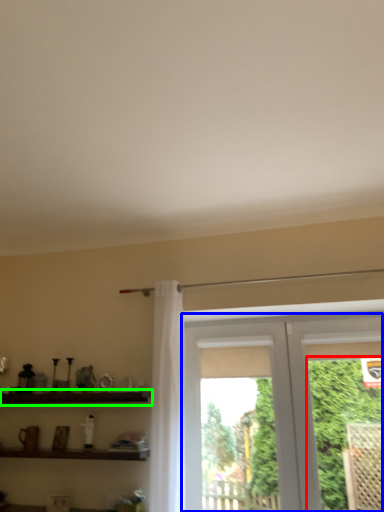
Question: Which object is positioned closest to plant (highlighted by a red box)? Select from window (highlighted by a blue box) and shelf (highlighted by a green box).

Choices:
 (A) window
 (B) shelf

Answer: (A)